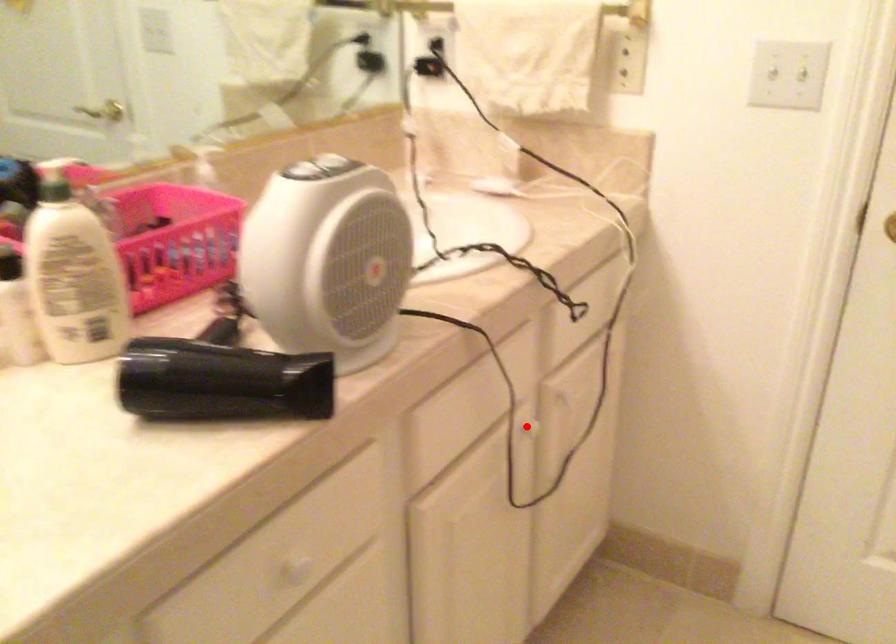
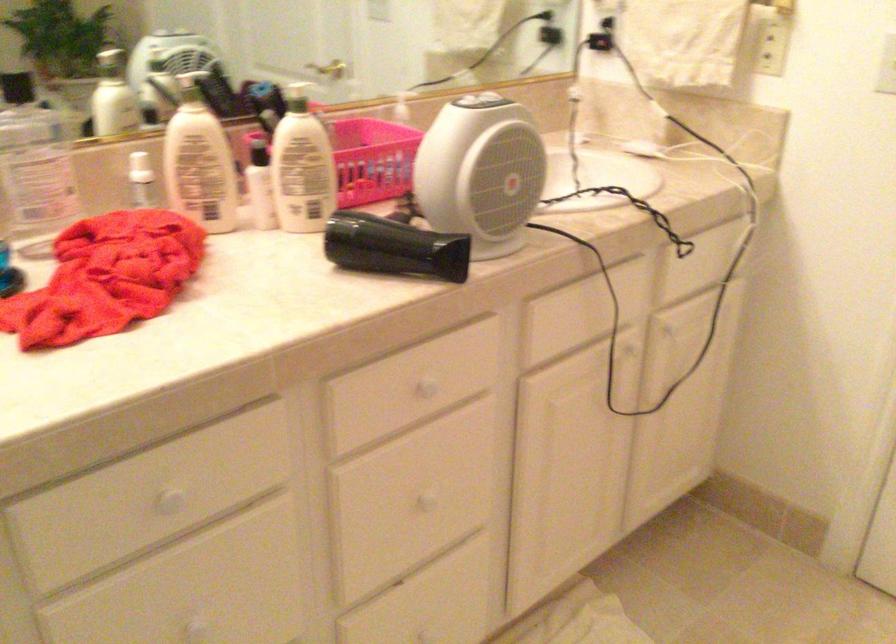
In the second image, find the point that corresponds to the highlighted location in the first image.

(625, 348)